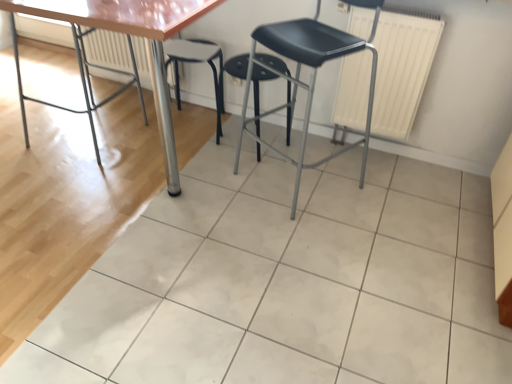
Identify the location of blank area beneath matte black stool at center (from a real-world perspective). Image resolution: width=512 pixels, height=384 pixels. (312, 189).